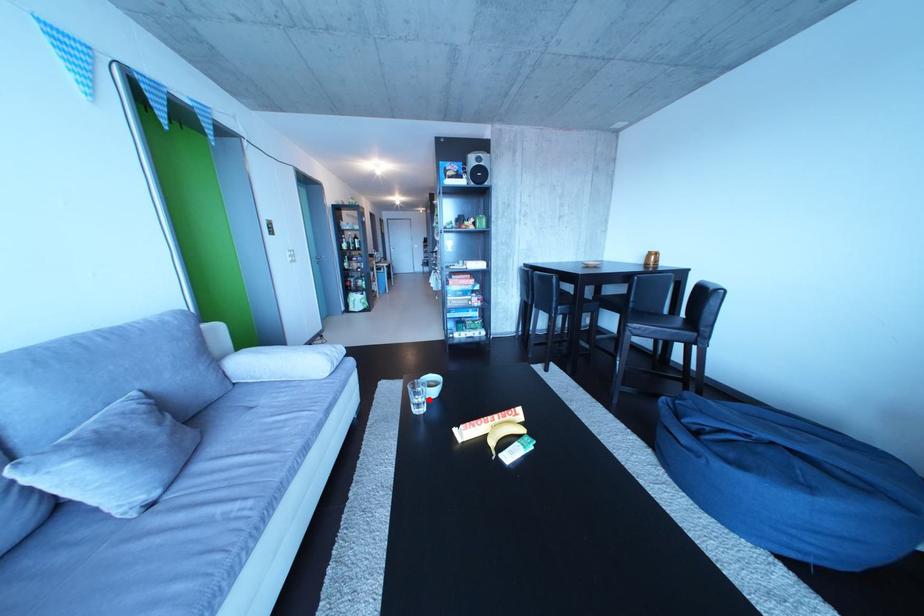
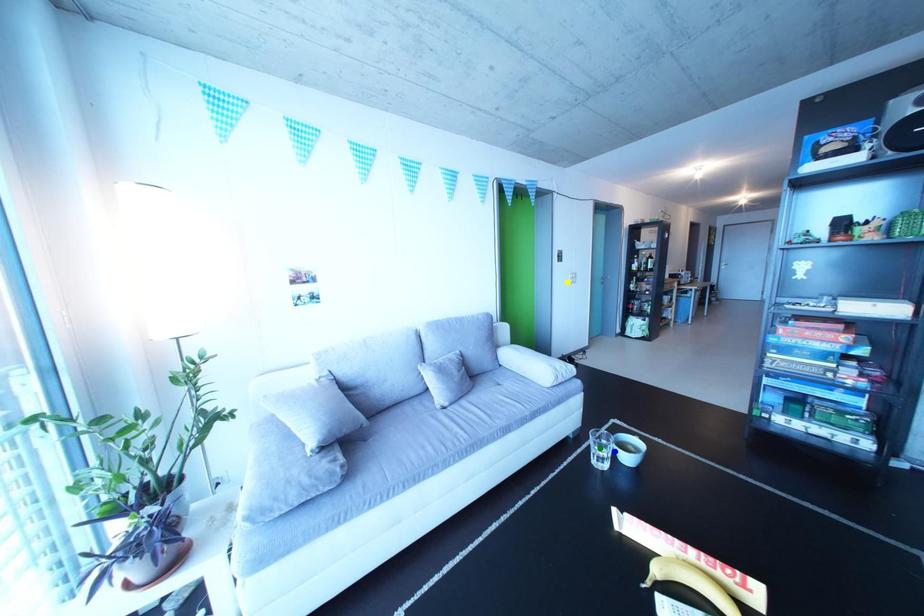
Question: I am providing you with two images of the same scene from different viewpoints. A red point is marked on the first image. You are given multiple points on the second image. Which point in image 2 is actually the same real-world point as the red point in image 1?

Choices:
 (A) yellow point
 (B) blue point
 (C) green point

Answer: (B)